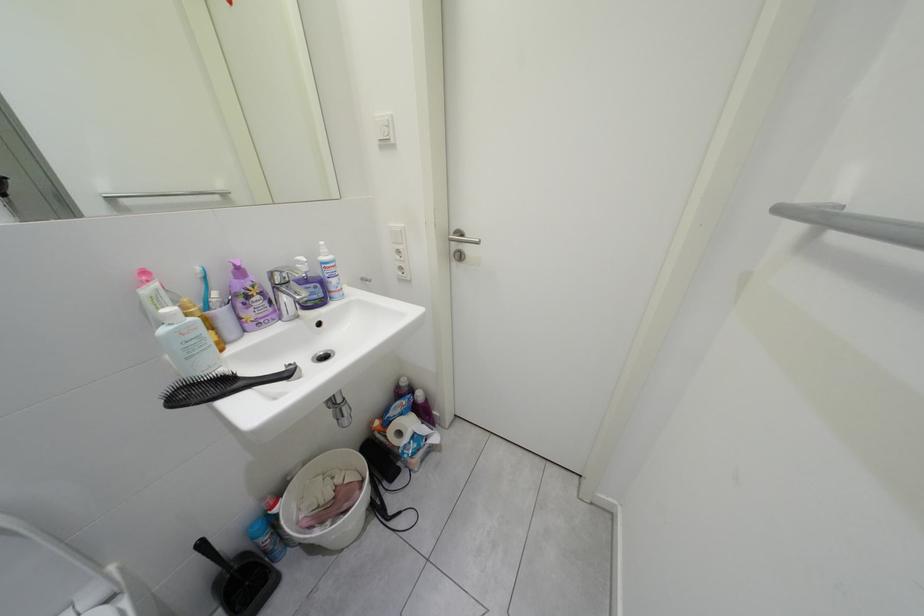
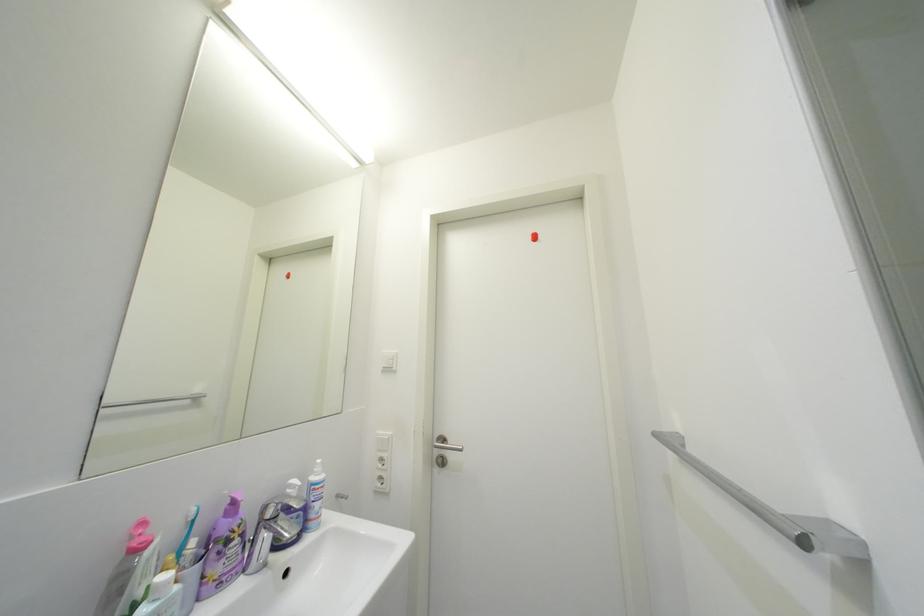
Question: How did the camera likely rotate?

Choices:
 (A) Left
 (B) Right
 (C) Up
 (D) Down

Answer: (C)